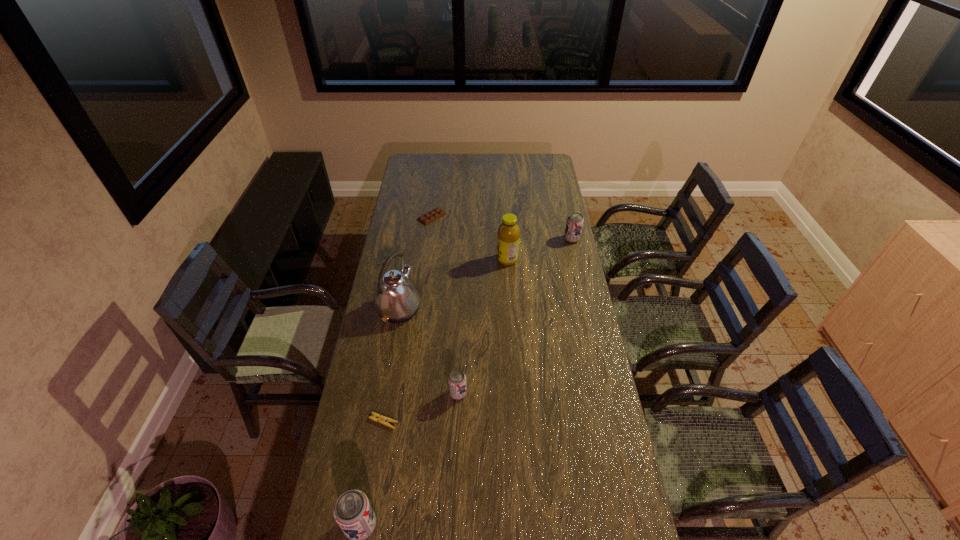
Find the location of `kettle at the left edge`. kettle at the left edge is located at coordinates (397, 300).

What are the coordinates of `object that is at the right edge` in the screenshot? It's located at (574, 224).

At what (x,y) coordinates should I click in order to perform the action: click on vacant space at the far edge of the desktop. Please return your answer as a coordinate pair (x, y). The width and height of the screenshot is (960, 540). Looking at the image, I should click on (453, 156).

In the image, there is a desktop. Where is `free space at the near edge`? free space at the near edge is located at coordinates (419, 498).

Find the location of a particular element. This screenshot has width=960, height=540. vacant point at the left edge is located at coordinates (366, 399).

This screenshot has width=960, height=540. I want to click on blank space at the right edge of the desktop, so click(565, 333).

You are a GUI agent. You are given a task and a screenshot of the screen. Output one action in this format:
    pyautogui.click(x=<x>, y=<y>)
    Task: Click on the vacant space at the far right corner
    This screenshot has height=540, width=960.
    Given the screenshot: What is the action you would take?
    pyautogui.click(x=534, y=168)

This screenshot has height=540, width=960. I want to click on vacant space that is in between the farthest object and the tallest object, so click(416, 262).

Locate an element on the screen. The height and width of the screenshot is (540, 960). vacant space in between the fourth shortest object and the fourth farthest object is located at coordinates (486, 274).

At what (x,y) coordinates should I click in order to perform the action: click on unoccupied position between the rightmost object and the sixth object from left to right. Please return your answer as a coordinate pair (x, y). Looking at the image, I should click on (540, 249).